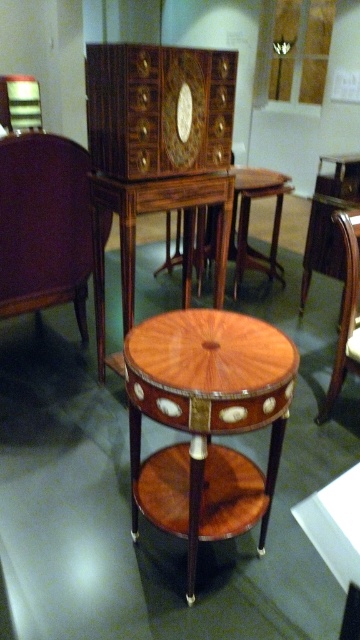
Does mahogany veneer round table at center come behind mahogany wood side table at center?

No.

Which of these two, mahogany veneer round table at center or mahogany wood side table at center, stands shorter?

With less height is mahogany veneer round table at center.

Is point (251, 362) less distant than point (248, 202)?

Yes, it is in front of point (248, 202).

Locate an element on the screen. This screenshot has width=360, height=640. mahogany veneer round table at center is located at coordinates (205, 420).

Is mahogany veneer drawer at center shorter than mahogany wood side table at center?

Correct, mahogany veneer drawer at center is not as tall as mahogany wood side table at center.

Can you confirm if mahogany veneer drawer at center is positioned below mahogany wood side table at center?

Correct, mahogany veneer drawer at center is located below mahogany wood side table at center.

Does point (284, 412) come behind point (281, 209)?

No.

The width and height of the screenshot is (360, 640). In order to click on mahogany veneer drawer at center in this screenshot , I will do `click(209, 403)`.

Who is positioned more to the right, mahogany veneer round table at center or mahogany wood chair at center?

From the viewer's perspective, mahogany wood chair at center appears more on the right side.

You are a GUI agent. You are given a task and a screenshot of the screen. Output one action in this format:
    pyautogui.click(x=<x>, y=<y>)
    Task: Click on the mahogany veneer round table at center
    This screenshot has width=360, height=640.
    Given the screenshot: What is the action you would take?
    pyautogui.click(x=205, y=420)

Find the location of a particular element. This screenshot has width=360, height=640. mahogany veneer round table at center is located at coordinates (205, 420).